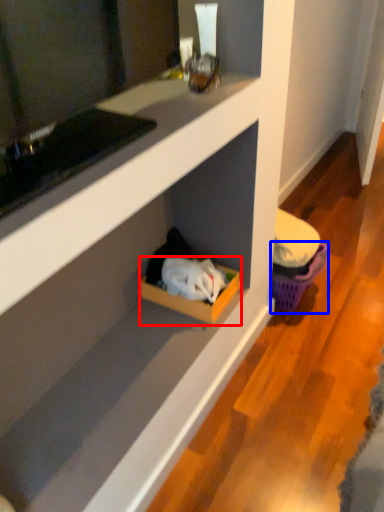
Question: Which object is further to the camera taking this photo, storage box (highlighted by a red box) or basket (highlighted by a blue box)?

Choices:
 (A) storage box
 (B) basket

Answer: (B)